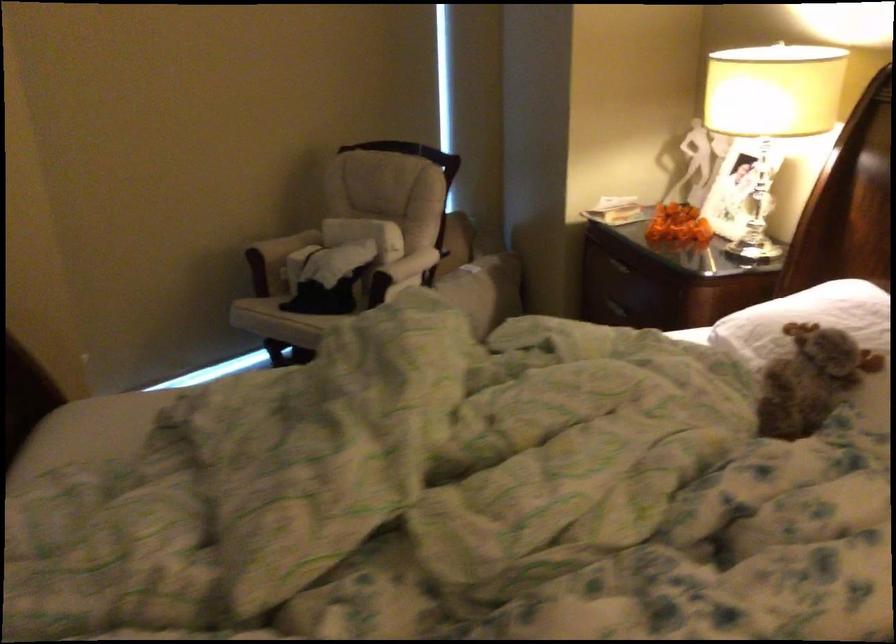
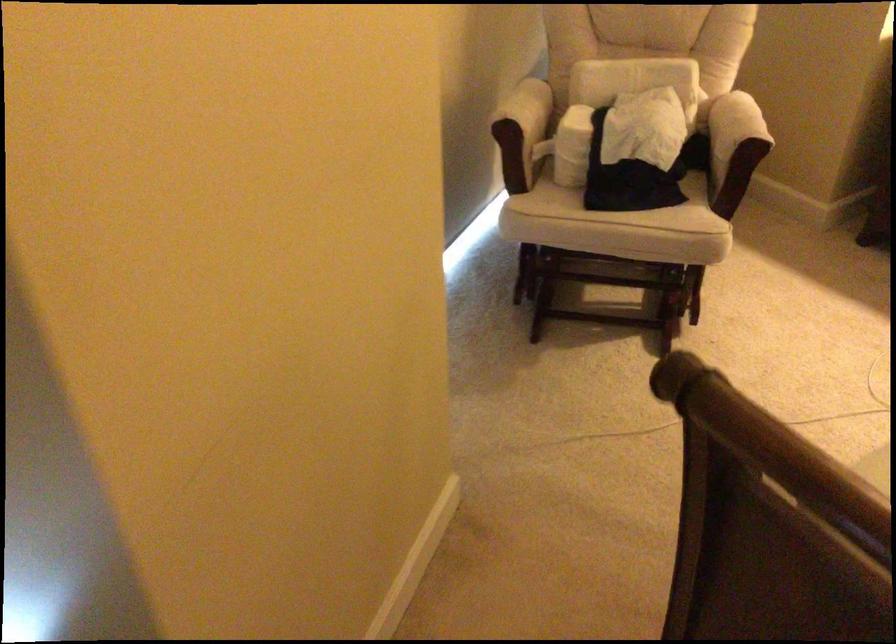
Consider the image. In a continuous first-person perspective shot, in which direction is the camera moving?

The cameraman moved toward left, forward.